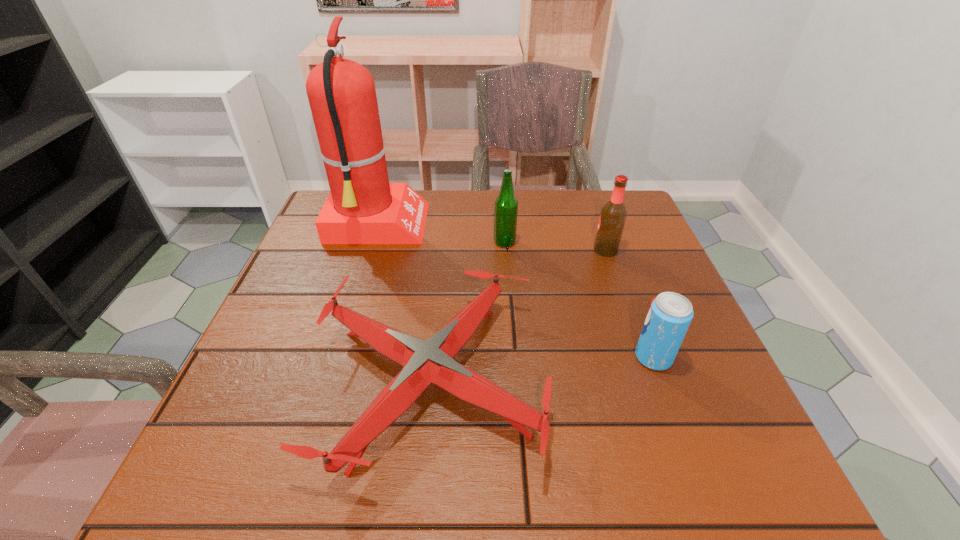
Where is `vacant space in between the soda can and the tallest object`? vacant space in between the soda can and the tallest object is located at coordinates (516, 292).

Where is `vacant point located between the fire extinguisher and the left beer bottle`? vacant point located between the fire extinguisher and the left beer bottle is located at coordinates (441, 234).

Locate an element on the screen. This screenshot has width=960, height=540. free spot between the right beer bottle and the soda can is located at coordinates (630, 304).

Image resolution: width=960 pixels, height=540 pixels. Find the location of `unoccupied area between the right beer bottle and the fire extinguisher`. unoccupied area between the right beer bottle and the fire extinguisher is located at coordinates (492, 238).

What are the coordinates of `free space between the drone and the fourth tallest object` in the screenshot? It's located at (542, 369).

Identify which object is the third nearest to the tallest object. Please provide its 2D coordinates. Your answer should be formatted as a tuple, i.e. [(x, y)], where the tuple contains the x and y coordinates of a point satisfying the conditions above.

[(613, 215)]

You are a GUI agent. You are given a task and a screenshot of the screen. Output one action in this format:
    pyautogui.click(x=<x>, y=<y>)
    Task: Click on the object that is the closest one to the left beer bottle
    
    Given the screenshot: What is the action you would take?
    pyautogui.click(x=363, y=207)

The width and height of the screenshot is (960, 540). Find the location of `free space that satisfies the following two spatial constraints: 1. on the label of the left beer bottle; 2. on the right side of the soda can`. free space that satisfies the following two spatial constraints: 1. on the label of the left beer bottle; 2. on the right side of the soda can is located at coordinates (513, 357).

Identify the location of vacant area in the image that satisfies the following two spatial constraints: 1. on the label of the right beer bottle; 2. on the right side of the left beer bottle. The image size is (960, 540). (505, 251).

At what (x,y) coordinates should I click in order to perform the action: click on vacant position in the image that satisfies the following two spatial constraints: 1. on the front-facing side of the shortest object; 2. on the right side of the fire extinguisher. Please return your answer as a coordinate pair (x, y). This screenshot has height=540, width=960. Looking at the image, I should click on pyautogui.click(x=329, y=380).